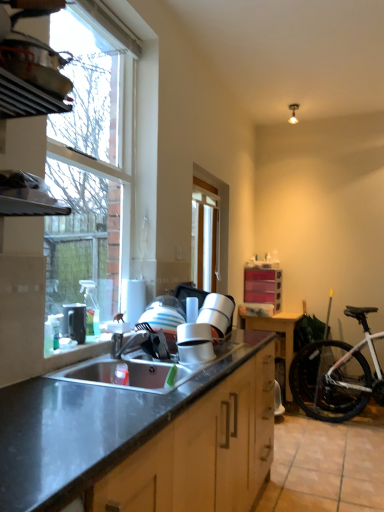
Identify the location of free point above clear glass window at center, which is the 1th window from right to left (from a real-world perspective). (207, 189).